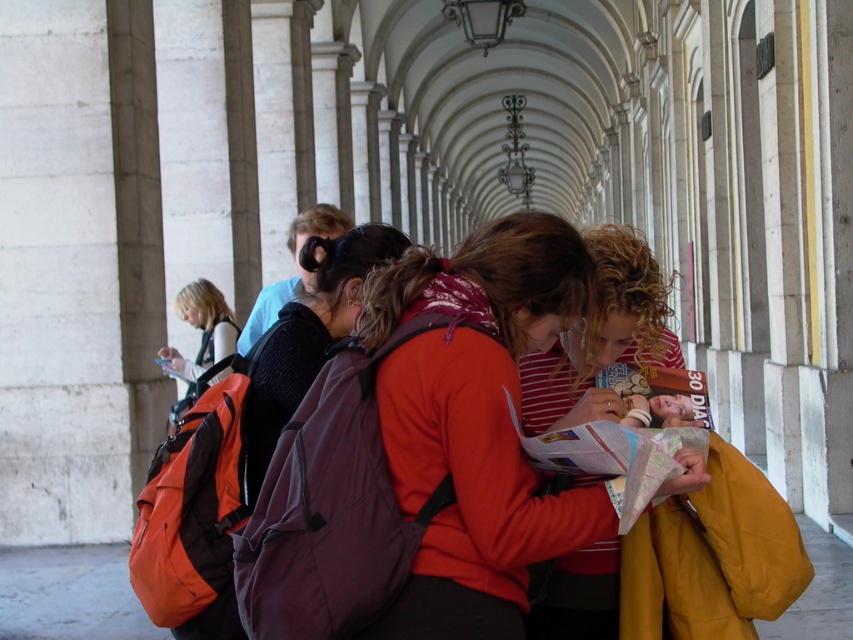
Which is in front, point (614, 604) or point (299, 336)?

Positioned in front is point (614, 604).

Which is behind, point (579, 564) or point (283, 419)?

The point (283, 419) is more distant.

Locate an element on the screen. This screenshot has height=640, width=853. red striped shirt at center is located at coordinates (602, 337).

Identify the location of red striped shirt at center. (602, 337).

Which is below, orange backpack at center or dark gray backpack at center?

orange backpack at center

Does orange backpack at center have a larger size compared to dark gray backpack at center?

Indeed, orange backpack at center has a larger size compared to dark gray backpack at center.

The width and height of the screenshot is (853, 640). What do you see at coordinates (476, 420) in the screenshot?
I see `orange backpack at center` at bounding box center [476, 420].

You are a GUI agent. You are given a task and a screenshot of the screen. Output one action in this format:
    pyautogui.click(x=<x>, y=<y>)
    Task: Click on the orange backpack at center
    The height and width of the screenshot is (640, 853).
    Given the screenshot: What is the action you would take?
    pyautogui.click(x=476, y=420)

Image resolution: width=853 pixels, height=640 pixels. Describe the element at coordinates (602, 337) in the screenshot. I see `red striped shirt at center` at that location.

Which is behind, point (596, 324) or point (160, 356)?

Point (160, 356)

This screenshot has height=640, width=853. Identify the location of red striped shirt at center. (602, 337).